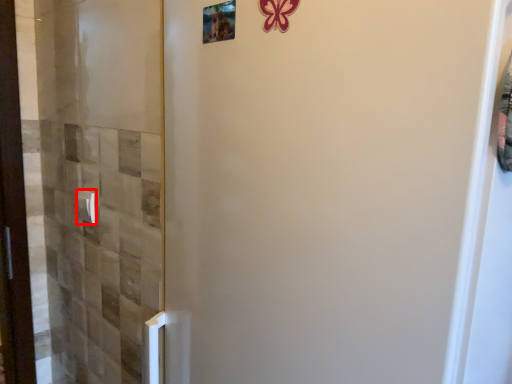
Question: From the image's perspective, considering the relative positions of door handle (annotated by the red box) and picture frame in the image provided, where is door handle (annotated by the red box) located with respect to the staircase?

Choices:
 (A) above
 (B) below

Answer: (B)